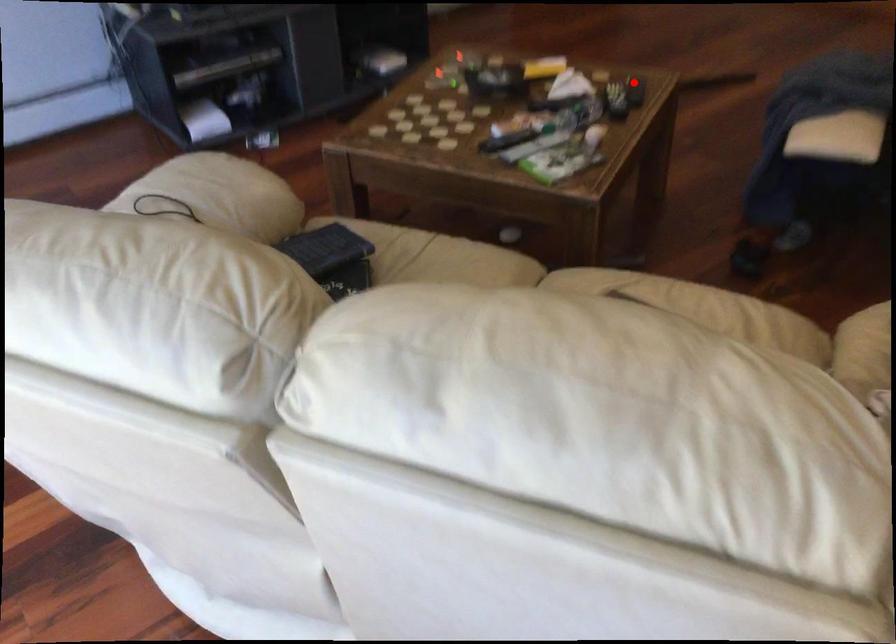
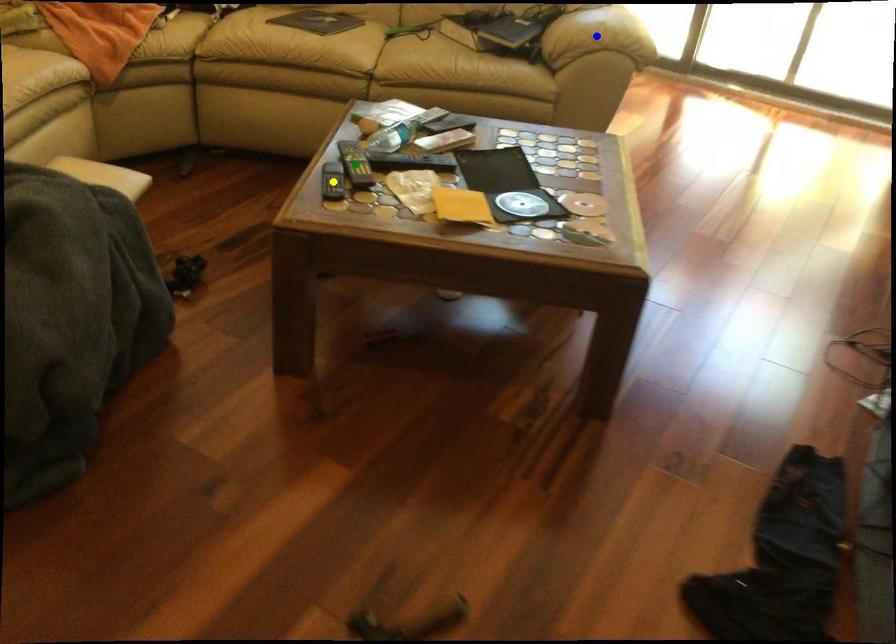
Question: I am providing you with two images of the same scene from different viewpoints. A red point is marked on the first image. You are given multiple points on the second image. Which spot in image 2 lines up with the point in image 1?

Choices:
 (A) green point
 (B) yellow point
 (C) blue point

Answer: (B)